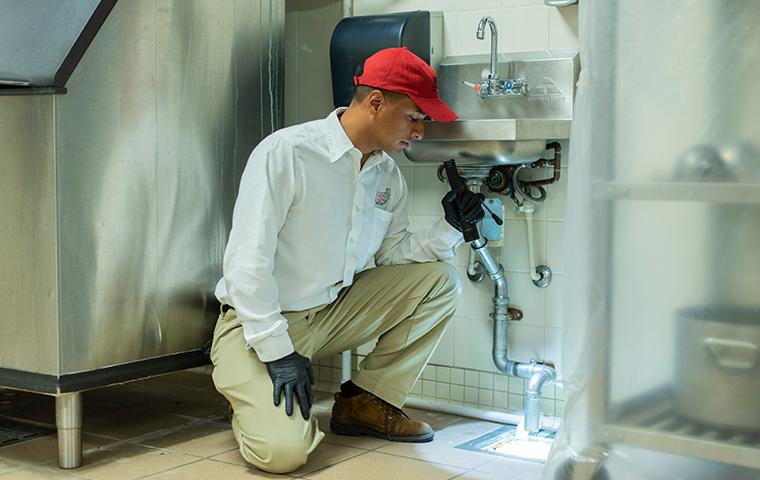
Locate an element on the screen. This screenshot has width=760, height=480. tile floor is located at coordinates (204, 432).